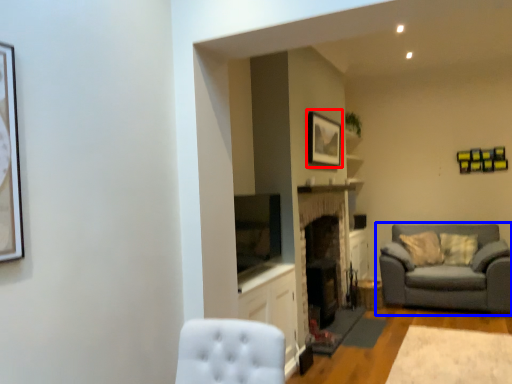
Question: Which point is further to the camera, picture frame (highlighted by a red box) or studio couch (highlighted by a blue box)?

Choices:
 (A) picture frame
 (B) studio couch

Answer: (B)